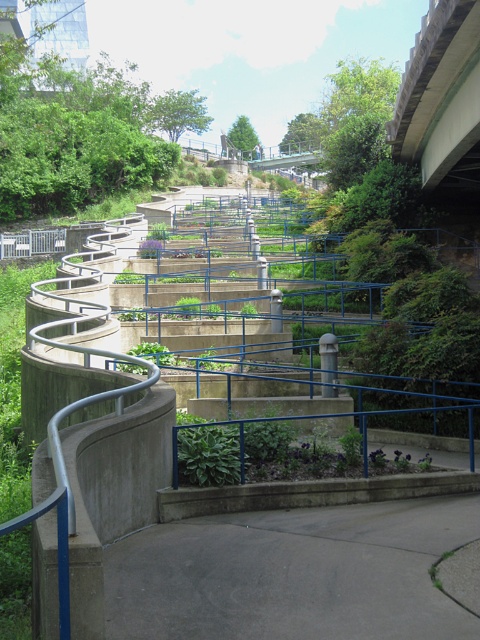
Question: Is gray concrete path at lower center bigger than concrete bridge at upper right?

Choices:
 (A) no
 (B) yes

Answer: (A)

Question: Does gray concrete path at lower center appear on the right side of concrete bridge at upper right?

Choices:
 (A) no
 (B) yes

Answer: (A)

Question: Which point is farther to the camera?

Choices:
 (A) (477, 113)
 (B) (104, 566)

Answer: (A)

Question: Observing the image, what is the correct spatial positioning of gray concrete path at lower center in reference to concrete bridge at upper right?

Choices:
 (A) left
 (B) right

Answer: (A)

Question: Which point is closer to the camera?

Choices:
 (A) (404, 88)
 (B) (419, 550)

Answer: (B)